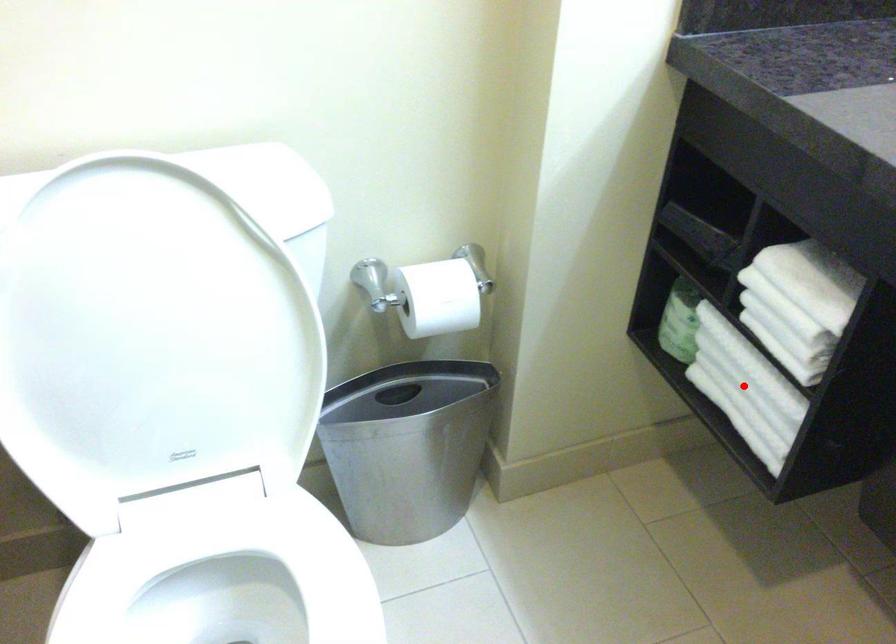
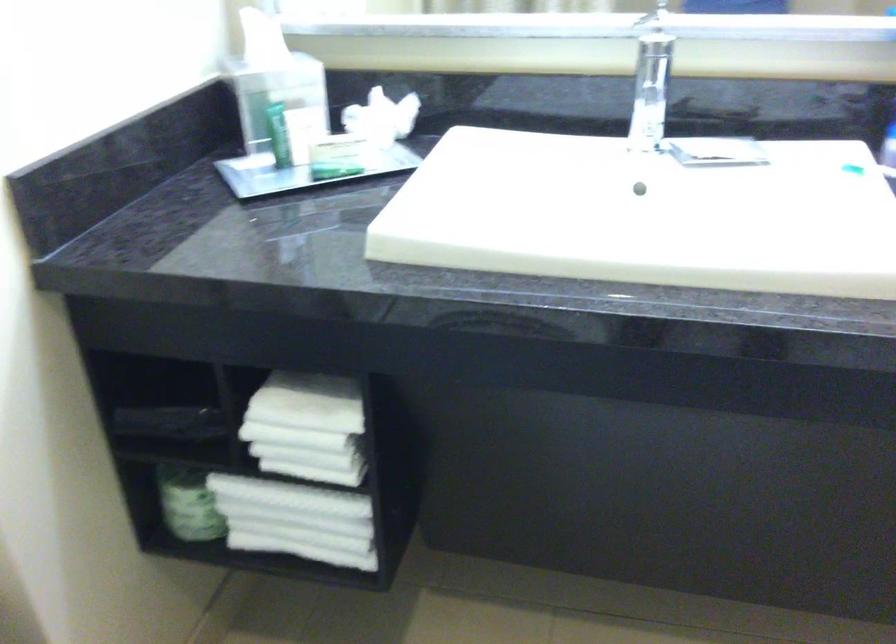
Where in the second image is the point corresponding to the highlighted location from the first image?

(296, 520)